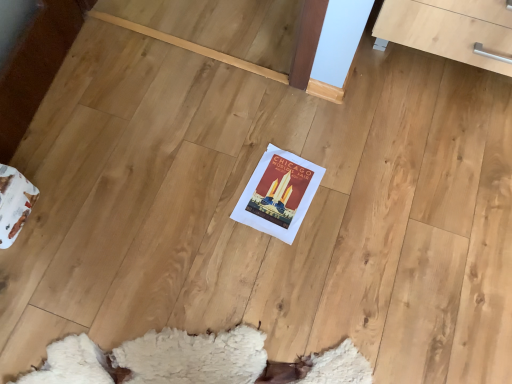
You are a GUI agent. You are given a task and a screenshot of the screen. Output one action in this format:
    pyautogui.click(x=<x>, y=<y>)
    Task: Click on the unoccupied space behind white paper magazine at center
    This screenshot has height=384, width=512.
    Given the screenshot: What is the action you would take?
    pyautogui.click(x=285, y=127)